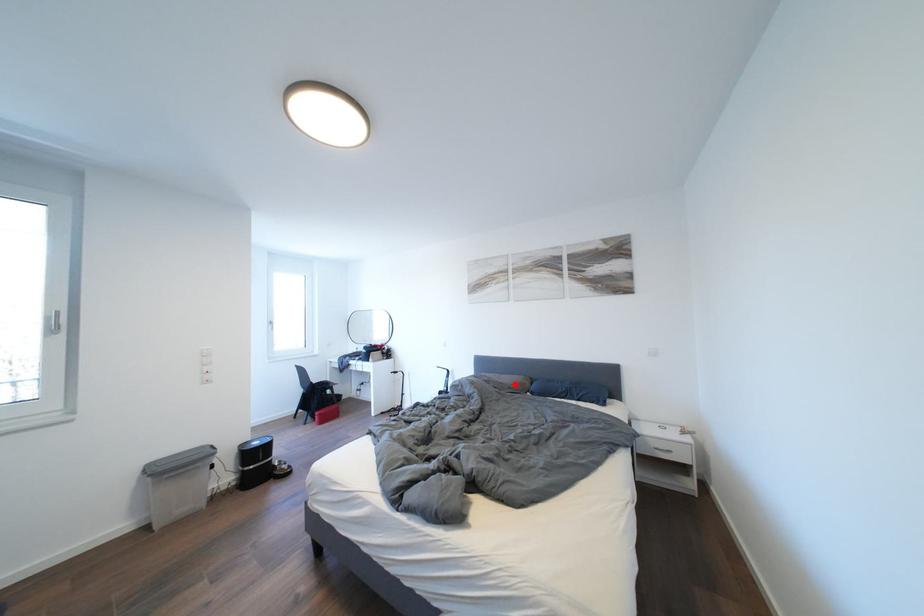
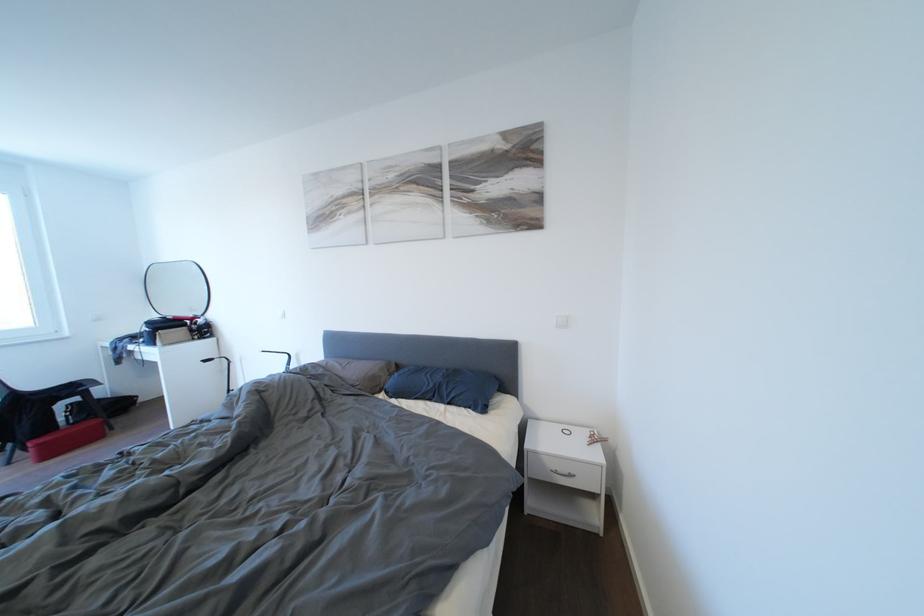
In the second image, find the point that corresponds to the highlighted location in the first image.

(363, 375)